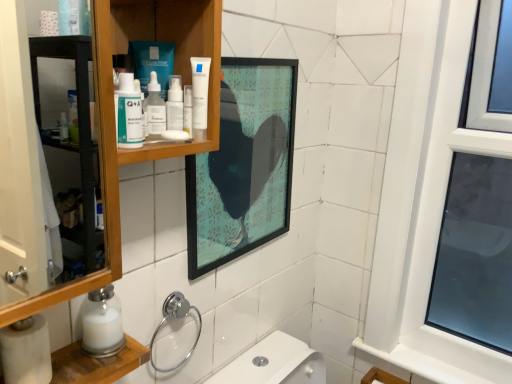
Question: Does white matte tube at upper center contain transparent plastic bottle at upper center?

Choices:
 (A) no
 (B) yes

Answer: (A)

Question: Are white matte tube at upper center and transparent plastic bottle at upper center making contact?

Choices:
 (A) no
 (B) yes

Answer: (B)

Question: Does white matte tube at upper center lie in front of transparent plastic bottle at upper center?

Choices:
 (A) no
 (B) yes

Answer: (B)

Question: Does white matte tube at upper center turn towards transparent plastic bottle at upper center?

Choices:
 (A) no
 (B) yes

Answer: (A)

Question: Is white matte tube at upper center thinner than transparent plastic bottle at upper center?

Choices:
 (A) no
 (B) yes

Answer: (A)

Question: From a real-world perspective, does white matte tube at upper center sit lower than transparent plastic bottle at upper center?

Choices:
 (A) yes
 (B) no

Answer: (B)

Question: Can you confirm if matte plastic q+a bottle at upper left is wider than wooden cabinet at upper left?

Choices:
 (A) no
 (B) yes

Answer: (A)

Question: Is matte plastic q+a bottle at upper left to the right of wooden cabinet at upper left from the viewer's perspective?

Choices:
 (A) no
 (B) yes

Answer: (B)

Question: Could you tell me if matte plastic q+a bottle at upper left is facing wooden cabinet at upper left?

Choices:
 (A) no
 (B) yes

Answer: (B)

Question: Is wooden cabinet at upper left inside matte plastic q+a bottle at upper left?

Choices:
 (A) yes
 (B) no

Answer: (B)

Question: Is matte plastic q+a bottle at upper left at the left side of wooden cabinet at upper left?

Choices:
 (A) yes
 (B) no

Answer: (B)

Question: Can we say matte plastic q+a bottle at upper left lies outside wooden cabinet at upper left?

Choices:
 (A) yes
 (B) no

Answer: (B)

Question: Can we say white matte tube at upper center lies outside wooden cabinet at upper left?

Choices:
 (A) yes
 (B) no

Answer: (B)